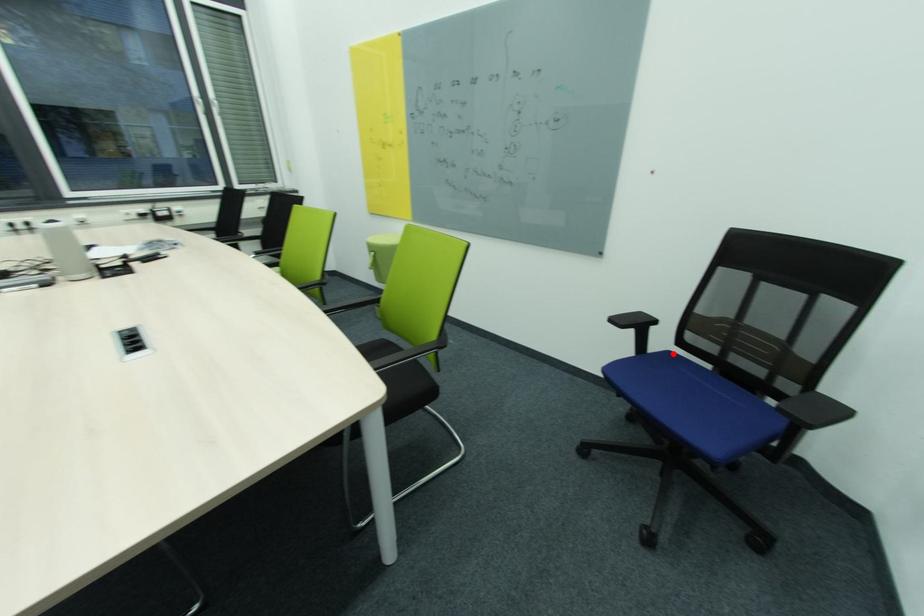
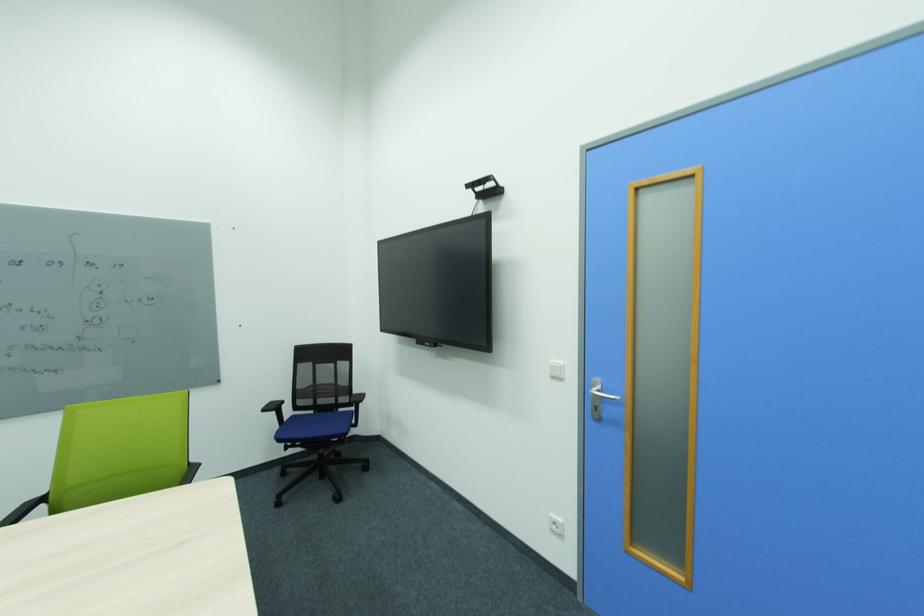
Where in the second image is the point corresponding to the highlighted location from the first image?

(297, 418)